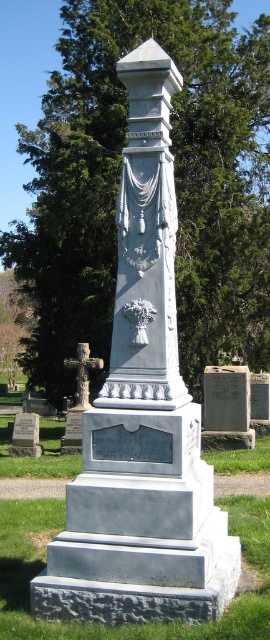
Is green leafy tree at upper center wider than dark gray stone cross at left?

Correct, the width of green leafy tree at upper center exceeds that of dark gray stone cross at left.

Which is in front, point (75, 106) or point (75, 397)?

Point (75, 397)

I want to click on green leafy tree at upper center, so click(x=174, y=182).

Looking at this image, who is shorter, green leafy tree at upper center or white marble monument at center?

Standing shorter between the two is white marble monument at center.

Which is in front, point (224, 100) or point (123, 316)?

Positioned in front is point (123, 316).

Who is more forward, (218,67) or (119,208)?

Point (119,208) is in front.

At what (x,y) coordinates should I click in order to perform the action: click on green leafy tree at upper center. Please return your answer as a coordinate pair (x, y). Looking at the image, I should click on (174, 182).

Who is more forward, (173, 328) or (86, 362)?

Positioned in front is point (173, 328).

Does white marble monument at center appear on the right side of dark gray stone cross at left?

Correct, you'll find white marble monument at center to the right of dark gray stone cross at left.

Where is `white marble monument at center`? The height and width of the screenshot is (640, 270). white marble monument at center is located at coordinates (146, 243).

Locate an element on the screen. This screenshot has width=270, height=640. white marble monument at center is located at coordinates (146, 243).